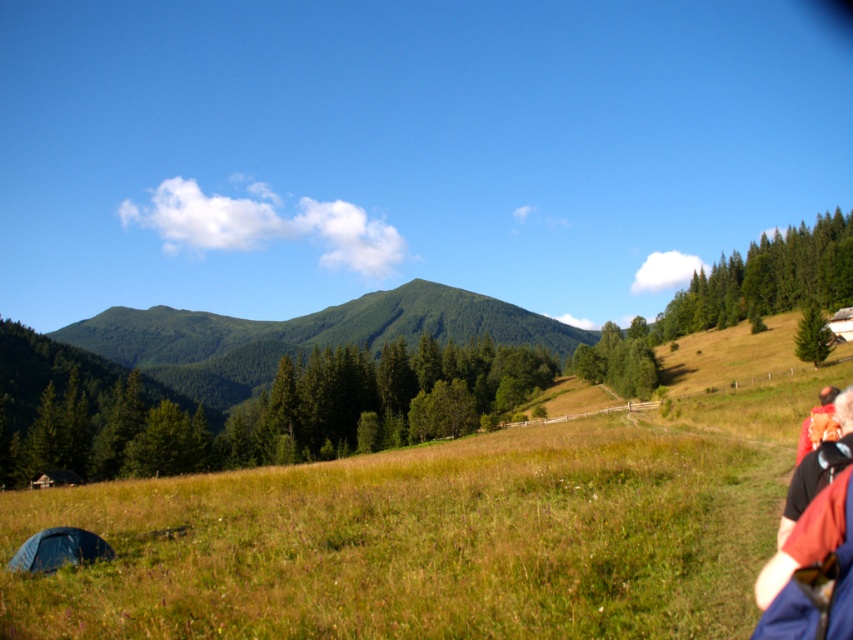
Can you confirm if red fabric jacket at lower right is positioned to the left of dark blue fabric tent at lower left?

No, red fabric jacket at lower right is not to the left of dark blue fabric tent at lower left.

What do you see at coordinates (816, 467) in the screenshot? I see `red fabric jacket at lower right` at bounding box center [816, 467].

The width and height of the screenshot is (853, 640). I want to click on red fabric jacket at lower right, so click(x=816, y=467).

Find the location of a particular element. Image resolution: width=853 pixels, height=640 pixels. red fabric jacket at lower right is located at coordinates (816, 467).

Does red fabric jacket at lower right have a larger size compared to camouflage jacket at lower right?

Actually, red fabric jacket at lower right might be smaller than camouflage jacket at lower right.

Is point (796, 499) farther from camera compared to point (816, 435)?

No, it is not.

Describe the element at coordinates (816, 467) in the screenshot. I see `red fabric jacket at lower right` at that location.

Identify the location of red fabric jacket at lower right. (816, 467).

Is the position of dark blue fabric tent at lower left more distant than that of camouflage jacket at lower right?

Yes, it is behind camouflage jacket at lower right.

Can you confirm if dark blue fabric tent at lower left is bigger than camouflage jacket at lower right?

Actually, dark blue fabric tent at lower left might be smaller than camouflage jacket at lower right.

The image size is (853, 640). Describe the element at coordinates (59, 548) in the screenshot. I see `dark blue fabric tent at lower left` at that location.

Identify the location of dark blue fabric tent at lower left. (59, 548).